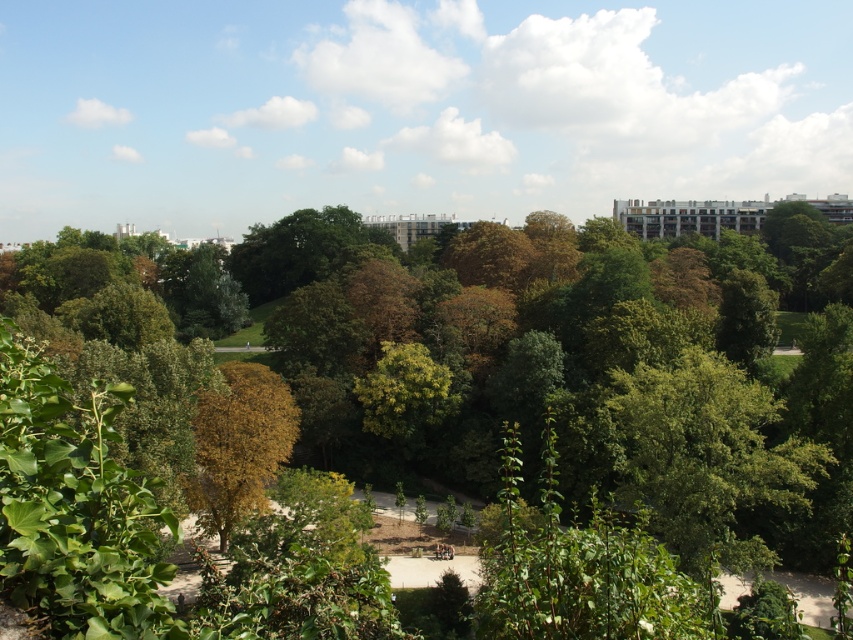
Question: Does green leafy park at center have a lesser width compared to brown leafy tree at center?

Choices:
 (A) yes
 (B) no

Answer: (B)

Question: Which of the following is the farthest from the observer?

Choices:
 (A) brown leafy tree at center
 (B) green leafy park at center

Answer: (A)

Question: Where is green leafy park at center located in relation to brown leafy tree at center in the image?

Choices:
 (A) below
 (B) above

Answer: (B)

Question: Can you confirm if green leafy park at center is positioned to the right of brown leafy tree at center?

Choices:
 (A) yes
 (B) no

Answer: (A)

Question: Among these points, which one is farthest from the camera?

Choices:
 (A) (212, 387)
 (B) (790, 481)

Answer: (A)